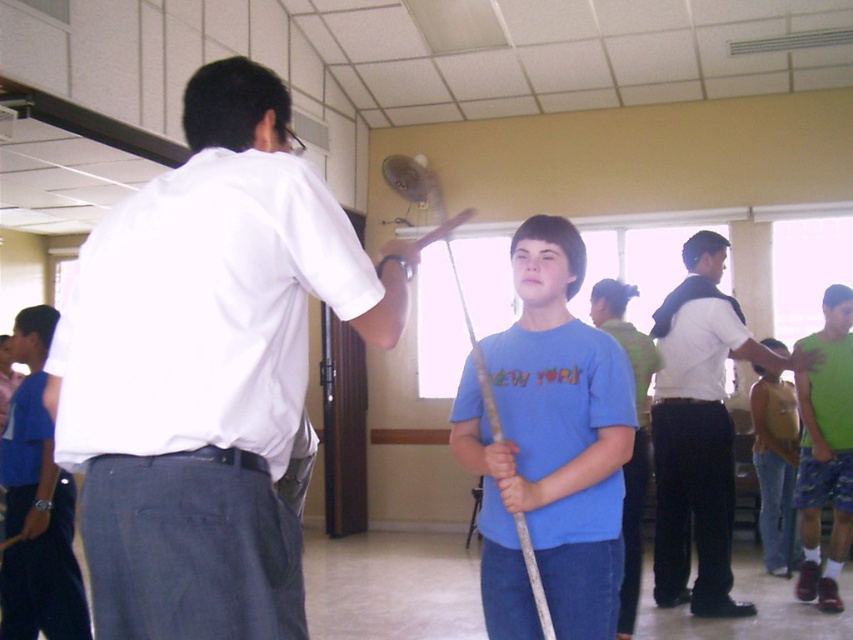
Can you confirm if white smooth shirt at center is positioned to the left of blue cotton shirt at center?

Yes, white smooth shirt at center is to the left of blue cotton shirt at center.

Find the location of a particular element. The image size is (853, 640). white smooth shirt at center is located at coordinates (206, 369).

Is white smooth shirt at center closer to the viewer compared to brown leather backpack at center?

Yes, white smooth shirt at center is closer to the viewer.

Is point (276, 400) in front of point (766, 426)?

Yes, it is in front of point (766, 426).

Identify the location of white smooth shirt at center. The width and height of the screenshot is (853, 640). (206, 369).

Which of these two, white shirt at right or brown leather backpack at center, stands shorter?

Standing shorter between the two is brown leather backpack at center.

Can you confirm if white shirt at right is taller than brown leather backpack at center?

Indeed, white shirt at right has a greater height compared to brown leather backpack at center.

What do you see at coordinates (699, 429) in the screenshot?
I see `white shirt at right` at bounding box center [699, 429].

This screenshot has width=853, height=640. In order to click on white shirt at right in this screenshot , I will do `click(699, 429)`.